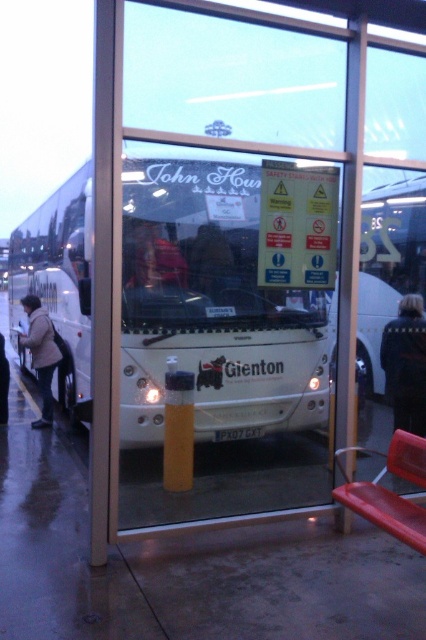
Question: Does dark fabric jacket at right have a smaller size compared to matte red jacket at center?

Choices:
 (A) yes
 (B) no

Answer: (B)

Question: Can you confirm if matte red jacket at center is positioned above light brown leather jacket at left?

Choices:
 (A) no
 (B) yes

Answer: (B)

Question: Does matte red jacket at center have a greater width compared to light brown leather jacket at left?

Choices:
 (A) yes
 (B) no

Answer: (B)

Question: Which object is positioned farthest from the light brown leather jacket at left?

Choices:
 (A) white matte bus at center
 (B) matte red jacket at center

Answer: (A)

Question: Which point is farther from the camera taking this photo?

Choices:
 (A) (46, 317)
 (B) (180, 356)

Answer: (A)

Question: Based on their relative distances, which object is nearer to the matte red jacket at center?

Choices:
 (A) light brown leather jacket at left
 (B) dark fabric jacket at right
 (C) white matte bus at center

Answer: (C)